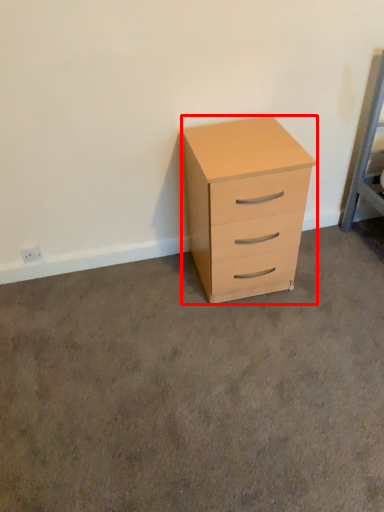
Question: Observing the image, what is the correct spatial positioning of chest of drawers (annotated by the red box) in reference to concrete?

Choices:
 (A) right
 (B) left

Answer: (B)